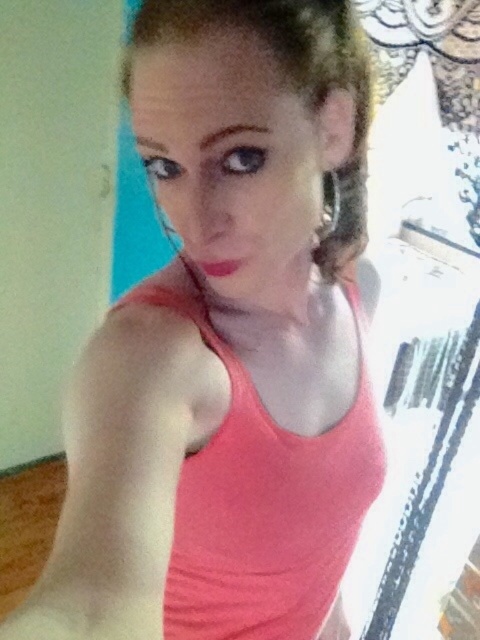
Question: Can you confirm if matte coral tank top at center is positioned to the left of matte pink lipstick at center?

Choices:
 (A) no
 (B) yes

Answer: (A)

Question: Which point is farther to the camera?

Choices:
 (A) matte coral tank top at center
 (B) matte pink lipstick at center

Answer: (A)

Question: Can you confirm if matte coral tank top at center is smaller than matte pink lipstick at center?

Choices:
 (A) no
 (B) yes

Answer: (A)

Question: Is matte coral tank top at center to the left of matte pink lipstick at center from the viewer's perspective?

Choices:
 (A) yes
 (B) no

Answer: (B)

Question: Which point is farther to the camera?

Choices:
 (A) [x=354, y=444]
 (B) [x=217, y=260]

Answer: (A)